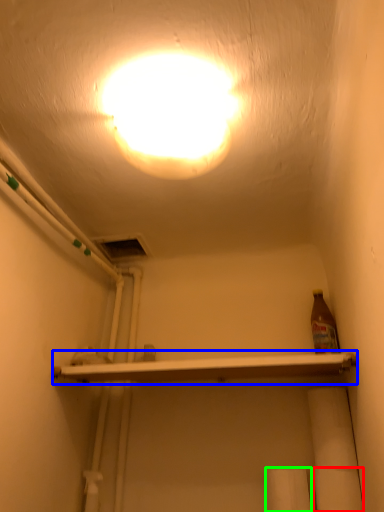
Question: Considering the real-world distances, which object is farthest from toilet paper (highlighted by a red box)? shelf (highlighted by a blue box) or toilet paper (highlighted by a green box)?

Choices:
 (A) shelf
 (B) toilet paper

Answer: (A)